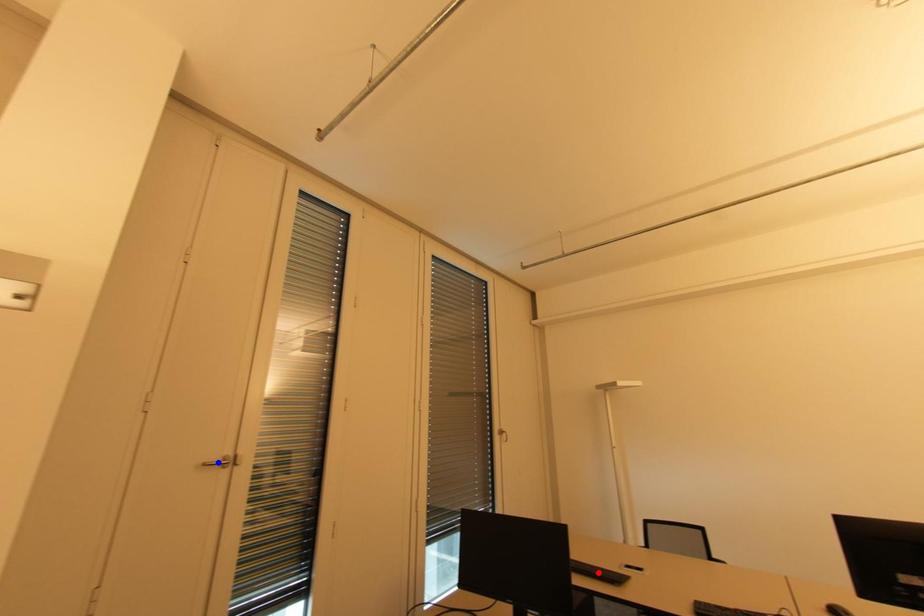
Question: Which of the two points in the image is closer to the camera?

Choices:
 (A) Blue point is closer.
 (B) Red point is closer.

Answer: (A)